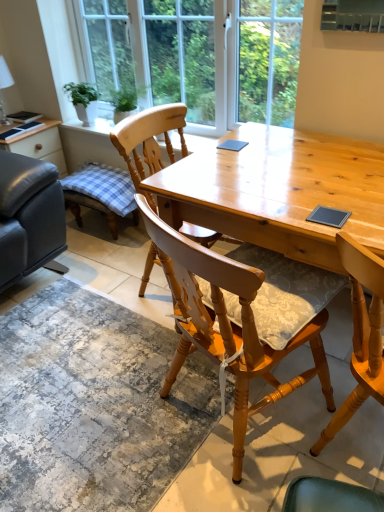
Question: Should I look upward or downward to see matte black leather couch at left?

Choices:
 (A) down
 (B) up

Answer: (B)

Question: Considering the relative positions of matte black leather couch at left and textured gray rug at lower center in the image provided, is matte black leather couch at left to the left of textured gray rug at lower center from the viewer's perspective?

Choices:
 (A) yes
 (B) no

Answer: (A)

Question: From the image's perspective, is matte black leather couch at left above textured gray rug at lower center?

Choices:
 (A) yes
 (B) no

Answer: (A)

Question: Are matte black leather couch at left and textured gray rug at lower center beside each other?

Choices:
 (A) yes
 (B) no

Answer: (B)

Question: Considering the relative sizes of matte black leather couch at left and textured gray rug at lower center in the image provided, is matte black leather couch at left taller than textured gray rug at lower center?

Choices:
 (A) no
 (B) yes

Answer: (B)

Question: Is matte black leather couch at left thinner than textured gray rug at lower center?

Choices:
 (A) yes
 (B) no

Answer: (A)

Question: Is the position of matte black leather couch at left less distant than that of textured gray rug at lower center?

Choices:
 (A) yes
 (B) no

Answer: (B)

Question: From a real-world perspective, is textured gray rug at lower center located higher than light brown wooden desk at center?

Choices:
 (A) no
 (B) yes

Answer: (A)

Question: From the image's perspective, is textured gray rug at lower center on light brown wooden desk at center?

Choices:
 (A) yes
 (B) no

Answer: (B)

Question: Is textured gray rug at lower center closer to camera compared to light brown wooden desk at center?

Choices:
 (A) yes
 (B) no

Answer: (B)

Question: Is textured gray rug at lower center directly adjacent to light brown wooden desk at center?

Choices:
 (A) no
 (B) yes

Answer: (A)

Question: Considering the relative sizes of textured gray rug at lower center and light brown wooden desk at center in the image provided, is textured gray rug at lower center smaller than light brown wooden desk at center?

Choices:
 (A) no
 (B) yes

Answer: (B)

Question: Is textured gray rug at lower center wider than light brown wooden desk at center?

Choices:
 (A) yes
 (B) no

Answer: (A)

Question: Considering the relative sizes of clear glass window at upper center and light brown wooden desk at center in the image provided, is clear glass window at upper center wider than light brown wooden desk at center?

Choices:
 (A) no
 (B) yes

Answer: (A)